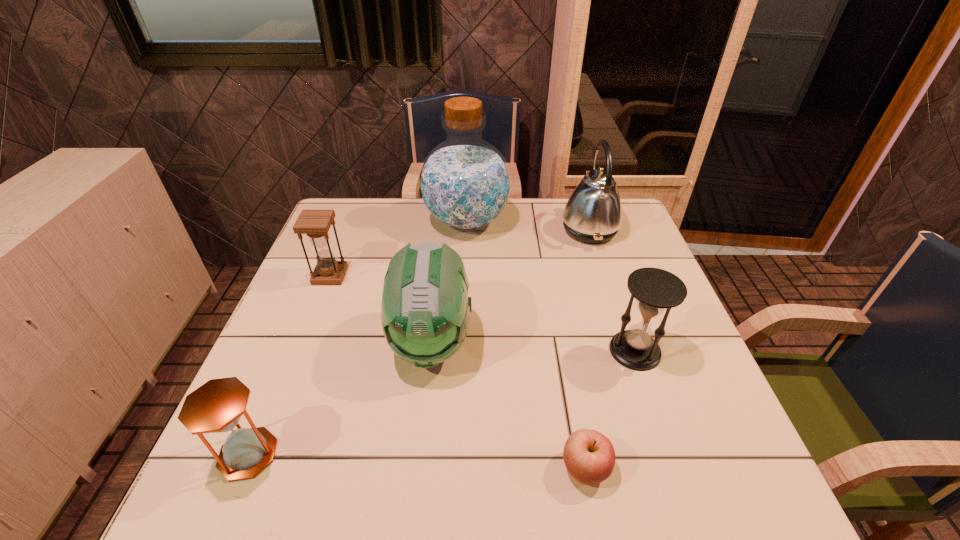
Locate an element on the screen. This screenshot has width=960, height=540. water jug is located at coordinates (464, 183).

Find the location of `kettle`. kettle is located at coordinates click(x=593, y=214).

Where is `football helmet`? This screenshot has height=540, width=960. football helmet is located at coordinates (425, 310).

Identify the location of the rightmost hourglass. (655, 290).

I want to click on the third farthest object, so click(x=315, y=224).

Locate an element on the screen. This screenshot has height=540, width=960. the nearest hourglass is located at coordinates (215, 407).

This screenshot has height=540, width=960. What are the coordinates of `apple` in the screenshot? It's located at (589, 456).

Find the location of a particular element. The height and width of the screenshot is (540, 960). the third object from right to left is located at coordinates (589, 456).

Where is `vacant space located 0.320m on the right of the tallest object`? vacant space located 0.320m on the right of the tallest object is located at coordinates (610, 221).

This screenshot has height=540, width=960. In order to click on free space located from the spout of the sixth shortest object in this screenshot , I will do `click(540, 230)`.